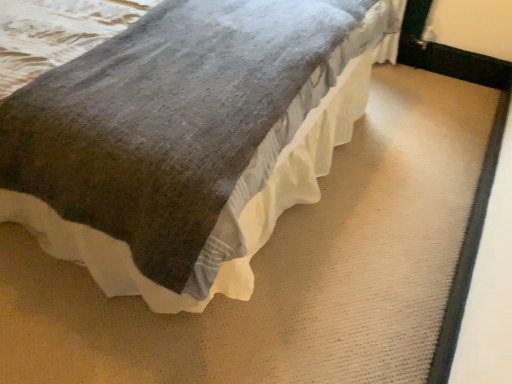
Question: Should I look upward or downward to see textured gray blanket at center?

Choices:
 (A) up
 (B) down

Answer: (A)